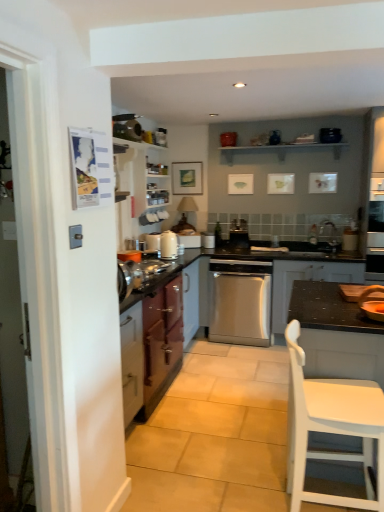
Question: Can you confirm if dark gray matte cabinet at center, the 3th cabinetry when ordered from left to right, is positioned to the right of white glossy kettle at center?

Choices:
 (A) yes
 (B) no

Answer: (A)

Question: Can you confirm if dark gray matte cabinet at center, the 3th cabinetry when ordered from left to right, is bigger than white glossy kettle at center?

Choices:
 (A) yes
 (B) no

Answer: (A)

Question: From a real-world perspective, is dark gray matte cabinet at center, marked as the 1th cabinetry in a right-to-left arrangement, on top of white glossy kettle at center?

Choices:
 (A) no
 (B) yes

Answer: (A)

Question: Is white glossy kettle at center at the back of dark gray matte cabinet at center, the 3th cabinetry when ordered from left to right?

Choices:
 (A) yes
 (B) no

Answer: (B)

Question: Is dark gray matte cabinet at center, the 3th cabinetry when ordered from left to right, far away from white glossy kettle at center?

Choices:
 (A) yes
 (B) no

Answer: (A)

Question: Can you confirm if dark gray matte cabinet at center, the 3th cabinetry when ordered from left to right, is taller than white glossy kettle at center?

Choices:
 (A) yes
 (B) no

Answer: (A)

Question: Is wooden bowl at right, the third appliance in the left-to-right sequence, further to the viewer compared to dark gray matte cabinet at center, the 3th cabinetry when ordered from left to right?

Choices:
 (A) no
 (B) yes

Answer: (A)

Question: Can you confirm if wooden bowl at right, which ranks as the 1th appliance in front-to-back order, is smaller than dark gray matte cabinet at center, the 3th cabinetry when ordered from left to right?

Choices:
 (A) yes
 (B) no

Answer: (A)

Question: Is wooden bowl at right, which ranks as the 1th appliance in front-to-back order, closer to camera compared to dark gray matte cabinet at center, the 3th cabinetry when ordered from left to right?

Choices:
 (A) no
 (B) yes

Answer: (B)

Question: Is wooden bowl at right, which appears as the first appliance when ordered from the bottom, to the right of dark gray matte cabinet at center, marked as the 1th cabinetry in a right-to-left arrangement, from the viewer's perspective?

Choices:
 (A) no
 (B) yes

Answer: (A)

Question: From a real-world perspective, is wooden bowl at right, which ranks as the 1th appliance in front-to-back order, located beneath dark gray matte cabinet at center, marked as the 1th cabinetry in a right-to-left arrangement?

Choices:
 (A) yes
 (B) no

Answer: (B)

Question: Is wooden bowl at right, the third appliance from the back, positioned with its back to dark gray matte cabinet at center, the 3th cabinetry when ordered from left to right?

Choices:
 (A) yes
 (B) no

Answer: (A)

Question: From the image's perspective, is satin silver dishwasher at center, placed as the second appliance when sorted from top to bottom, beneath wooden bowl at right, the third appliance in the left-to-right sequence?

Choices:
 (A) no
 (B) yes

Answer: (A)